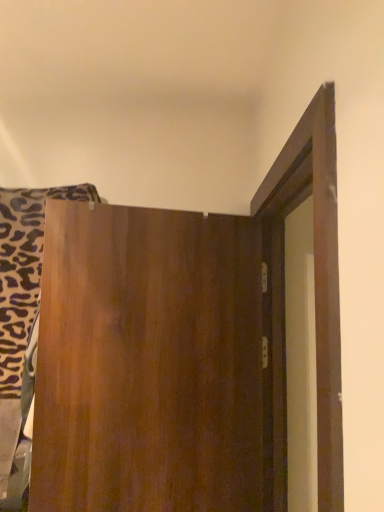
At what (x,y) coordinates should I click in order to perform the action: click on wooden door at center. Please return your answer as a coordinate pair (x, y). This screenshot has height=512, width=384. Looking at the image, I should click on (193, 347).

What is the approximate height of wooden door at center?

wooden door at center is 38.12 inches tall.

Image resolution: width=384 pixels, height=512 pixels. What do you see at coordinates (193, 347) in the screenshot?
I see `wooden door at center` at bounding box center [193, 347].

What is the approximate height of wooden board at left?

The height of wooden board at left is 37.04 inches.

What do you see at coordinates (22, 318) in the screenshot? The width and height of the screenshot is (384, 512). I see `wooden board at left` at bounding box center [22, 318].

The height and width of the screenshot is (512, 384). I want to click on wooden board at left, so pyautogui.click(x=22, y=318).

Identify the location of wooden door at center. The height and width of the screenshot is (512, 384). (193, 347).

Is wooden door at center to the left or to the right of wooden board at left in the image?

wooden door at center is positioned on wooden board at left's right side.

Looking at this image, which object is further away from the camera taking this photo, wooden door at center or wooden board at left?

wooden board at left is further away from the camera.

Between point (334, 129) and point (31, 229), which one is positioned in front?

The point (334, 129) is in front.

From the image's perspective, which one is positioned higher, wooden door at center or wooden board at left?

wooden board at left appears higher in the image.

From a real-world perspective, is wooden door at center over wooden board at left?

No, from a real-world perspective, wooden door at center is not over wooden board at left

In terms of width, does wooden door at center look wider or thinner when compared to wooden board at left?

In the image, wooden door at center appears to be more narrow than wooden board at left.

Is wooden door at center taller or shorter than wooden board at left?

Clearly, wooden door at center is taller compared to wooden board at left.

In terms of size, does wooden door at center appear bigger or smaller than wooden board at left?

wooden door at center is bigger than wooden board at left.

Can wooden board at left be found inside wooden door at center?

Definitely not — wooden board at left is not inside wooden door at center.

Is wooden door at center directly adjacent to wooden board at left?

No, wooden door at center is not beside wooden board at left.

Is wooden door at center oriented towards wooden board at left?

No, wooden door at center is not facing towards wooden board at left.

This screenshot has height=512, width=384. Identify the location of door that is below the wooden board at left (from the image's perspective). (193, 347).

Can you confirm if wooden board at left is positioned to the left of wooden door at center?

Correct, you'll find wooden board at left to the left of wooden door at center.

Looking at this image, considering their positions, is wooden board at left located in front of or behind wooden door at center?

wooden board at left is behind wooden door at center.

Is point (34, 295) positioned after point (232, 392)?

That is True.

From the image's perspective, is wooden board at left on top of wooden door at center?

Yes.

From a real-world perspective, is wooden board at left physically located above or below wooden door at center?

From a real-world perspective, wooden board at left is physically above wooden door at center.

Is wooden board at left wider than wooden door at center?

Yes.

Who is shorter, wooden board at left or wooden door at center?

wooden board at left.

Consider the image. Considering the sizes of objects wooden board at left and wooden door at center in the image provided, who is smaller, wooden board at left or wooden door at center?

wooden board at left.

Is wooden door at center a part of wooden board at left?

That's incorrect, wooden door at center is not inside wooden board at left.

Is wooden board at left placed right next to wooden door at center?

No, wooden board at left is not next to wooden door at center.

Is wooden board at left facing towards wooden door at center?

No, wooden board at left is not oriented towards wooden door at center.

What's the angular difference between wooden board at left and wooden door at center's facing directions?

16.4 degrees separate the facing orientations of wooden board at left and wooden door at center.

Where is `laundry that appears behind the wooden door at center`? laundry that appears behind the wooden door at center is located at coordinates (22, 318).

Identify the location of door located underneath the wooden board at left (from a real-world perspective). pyautogui.click(x=193, y=347).

Where is `laundry behind the wooden door at center`? The height and width of the screenshot is (512, 384). laundry behind the wooden door at center is located at coordinates (22, 318).